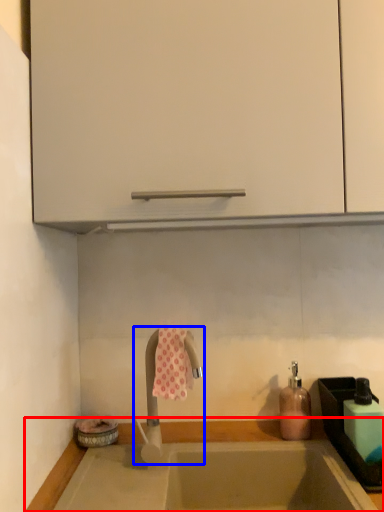
Question: Which object is closer to the camera taking this photo, countertop (highlighted by a red box) or tap (highlighted by a blue box)?

Choices:
 (A) countertop
 (B) tap

Answer: (A)